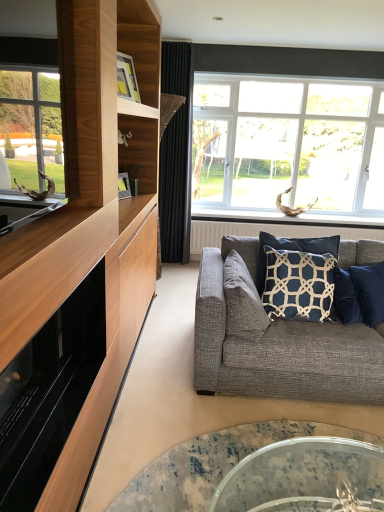
Question: Can you confirm if black velvet curtain at center is smaller than translucent glass coffee table at lower center?

Choices:
 (A) no
 (B) yes

Answer: (A)

Question: Is black velvet curtain at center closer to the viewer compared to translucent glass coffee table at lower center?

Choices:
 (A) yes
 (B) no

Answer: (B)

Question: Is black velvet curtain at center bigger than translucent glass coffee table at lower center?

Choices:
 (A) yes
 (B) no

Answer: (A)

Question: Can you confirm if black velvet curtain at center is shorter than translucent glass coffee table at lower center?

Choices:
 (A) no
 (B) yes

Answer: (A)

Question: Would you say black velvet curtain at center is outside translucent glass coffee table at lower center?

Choices:
 (A) yes
 (B) no

Answer: (A)

Question: Considering the relative positions of black velvet curtain at center and translucent glass coffee table at lower center in the image provided, is black velvet curtain at center to the right of translucent glass coffee table at lower center from the viewer's perspective?

Choices:
 (A) no
 (B) yes

Answer: (A)

Question: Does textured gray pillow at center, the 1th pillow viewed from the left, turn towards dark blue fabric pillow at center, the first pillow positioned from the right?

Choices:
 (A) yes
 (B) no

Answer: (A)

Question: Is textured gray pillow at center, the 1th pillow viewed from the left, smaller than dark blue fabric pillow at center, the first pillow positioned from the right?

Choices:
 (A) no
 (B) yes

Answer: (B)

Question: From a real-world perspective, does textured gray pillow at center, the 1th pillow viewed from the left, sit lower than dark blue fabric pillow at center, which is counted as the second pillow, starting from the left?

Choices:
 (A) yes
 (B) no

Answer: (A)

Question: Is textured gray pillow at center, which is the 2th pillow from right to left, not within dark blue fabric pillow at center, which is counted as the second pillow, starting from the left?

Choices:
 (A) yes
 (B) no

Answer: (A)

Question: From the image's perspective, does textured gray pillow at center, which is the 2th pillow from right to left, appear lower than dark blue fabric pillow at center, the first pillow positioned from the right?

Choices:
 (A) no
 (B) yes

Answer: (B)

Question: From the image's perspective, does textured gray pillow at center, the 1th pillow viewed from the left, appear higher than dark blue fabric pillow at center, the first pillow positioned from the right?

Choices:
 (A) no
 (B) yes

Answer: (A)

Question: Considering the relative sizes of white plastic window at upper right and matte black fireplace at left in the image provided, is white plastic window at upper right thinner than matte black fireplace at left?

Choices:
 (A) no
 (B) yes

Answer: (B)